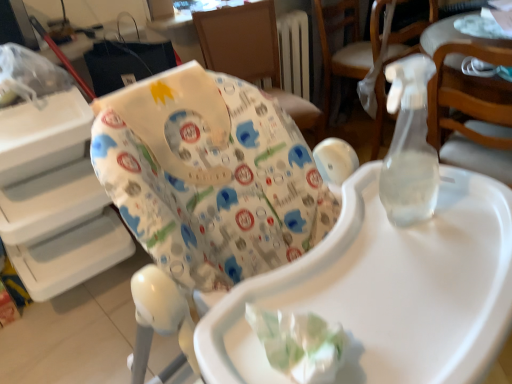
What is the approximate height of wooden chair at upper right, arranged as the 1th chair when viewed from the right?

wooden chair at upper right, arranged as the 1th chair when viewed from the right, is 31.94 inches tall.

How much space does wooden chair at upper right, arranged as the 1th chair when viewed from the right, occupy horizontally?

18.63 inches.

From the picture: In order to face white glossy table at upper right, should I rotate leftwards or rightwards?

Turn right by 29.676 degrees to look at white glossy table at upper right.

Identify the location of white fabric highchair at center, which is the first chair in left-to-right order. (252, 54).

Identify the location of wooden chair at upper right, arranged as the 1th chair when viewed from the right. (343, 47).

Considering the positions of point (455, 64) and point (329, 26), is point (455, 64) closer or farther from the camera than point (329, 26)?

Point (455, 64) is positioned closer to the camera compared to point (329, 26).

Looking at this image, is white glossy table at upper right not within wooden chair at upper right, arranged as the 1th chair when viewed from the right?

white glossy table at upper right is positioned outside wooden chair at upper right, arranged as the 1th chair when viewed from the right.

Is white glossy table at upper right wider or thinner than wooden chair at upper right, placed as the second chair when sorted from left to right?

In the image, white glossy table at upper right appears to be more narrow than wooden chair at upper right, placed as the second chair when sorted from left to right.

From the image's perspective, relative to wooden chair at upper right, arranged as the 1th chair when viewed from the right, is white glossy table at upper right above or below?

white glossy table at upper right is below wooden chair at upper right, arranged as the 1th chair when viewed from the right.

In the scene shown: Is white fabric highchair at center, which is the first chair in left-to-right order, placed right next to wooden chair at upper right, placed as the second chair when sorted from left to right?

No, white fabric highchair at center, which is the first chair in left-to-right order, is not next to wooden chair at upper right, placed as the second chair when sorted from left to right.

Is white fabric highchair at center, which is the first chair in left-to-right order, oriented away from wooden chair at upper right, arranged as the 1th chair when viewed from the right?

No.

Considering the relative sizes of white fabric highchair at center, the 2th chair from the right, and wooden chair at upper right, arranged as the 1th chair when viewed from the right, in the image provided, is white fabric highchair at center, the 2th chair from the right, wider than wooden chair at upper right, arranged as the 1th chair when viewed from the right,?

Indeed, white fabric highchair at center, the 2th chair from the right, has a greater width compared to wooden chair at upper right, arranged as the 1th chair when viewed from the right.

Who is smaller, white fabric highchair at center, which is the first chair in left-to-right order, or wooden chair at upper right, arranged as the 1th chair when viewed from the right?

With smaller size is wooden chair at upper right, arranged as the 1th chair when viewed from the right.

In the scene shown: Between white fabric baby seat at upper center and white fabric highchair at center, the 2th chair from the right, which one has more height?

white fabric baby seat at upper center is taller.

Who is smaller, white fabric baby seat at upper center or white fabric highchair at center, the 2th chair from the right?

Smaller between the two is white fabric highchair at center, the 2th chair from the right.

Would you say white fabric baby seat at upper center is a long distance from white fabric highchair at center, the 2th chair from the right?

That's right, there is a large distance between white fabric baby seat at upper center and white fabric highchair at center, the 2th chair from the right.

How much distance is there between white fabric baby seat at upper center and white fabric highchair at center, which is the first chair in left-to-right order?

white fabric baby seat at upper center is 4.28 feet from white fabric highchair at center, which is the first chair in left-to-right order.

Considering the sizes of objects white glossy table at upper right and white fabric highchair at center, which is the first chair in left-to-right order, in the image provided, who is thinner, white glossy table at upper right or white fabric highchair at center, which is the first chair in left-to-right order,?

white glossy table at upper right is thinner.

Is white glossy table at upper right oriented towards white fabric highchair at center, the 2th chair from the right?

No, white glossy table at upper right is not oriented towards white fabric highchair at center, the 2th chair from the right.

How many degrees apart are the facing directions of white glossy table at upper right and white fabric highchair at center, the 2th chair from the right?

white glossy table at upper right and white fabric highchair at center, the 2th chair from the right, are facing 94.7 degrees away from each other.

How much distance is there between white glossy table at upper right and white fabric highchair at center, the 2th chair from the right?

The distance of white glossy table at upper right from white fabric highchair at center, the 2th chair from the right, is 31.98 inches.

You are a GUI agent. You are given a task and a screenshot of the screen. Output one action in this format:
    pyautogui.click(x=<x>, y=<y>)
    Task: Click on the 1st chair counting from the left of the white glossy table at upper right
    
    Given the screenshot: What is the action you would take?
    pyautogui.click(x=343, y=47)

From the picture: Considering the relative sizes of wooden chair at upper right, placed as the second chair when sorted from left to right, and white glossy table at upper right in the image provided, is wooden chair at upper right, placed as the second chair when sorted from left to right, taller than white glossy table at upper right?

Yes.

Which is in front, point (362, 48) or point (429, 48)?

The point (429, 48) is more forward.

Can you confirm if white fabric highchair at center, the 2th chair from the right, is shorter than white fabric baby seat at upper center?

Yes, white fabric highchair at center, the 2th chair from the right, is shorter than white fabric baby seat at upper center.

Which is farther from the camera, (248, 66) or (146, 183)?

The point (248, 66) is farther.

Does white fabric highchair at center, the 2th chair from the right, appear on the right side of white fabric baby seat at upper center?

Yes.

Is wooden chair at upper right, placed as the second chair when sorted from left to right, at the back of white fabric baby seat at upper center?

No.

From a real-world perspective, between white fabric baby seat at upper center and wooden chair at upper right, placed as the second chair when sorted from left to right, who is vertically higher?

In real-world perspective, white fabric baby seat at upper center is above.

In the scene shown: Between white fabric baby seat at upper center and wooden chair at upper right, arranged as the 1th chair when viewed from the right, which one has larger size?

white fabric baby seat at upper center is bigger.

Who is shorter, white fabric baby seat at upper center or wooden chair at upper right, arranged as the 1th chair when viewed from the right?

wooden chair at upper right, arranged as the 1th chair when viewed from the right, is shorter.

This screenshot has width=512, height=384. What are the coordinates of `table below the wooden chair at upper right, arranged as the 1th chair when viewed from the right (from the image's perspective)` in the screenshot? It's located at [441, 34].

Where is `chair above the wooden chair at upper right, placed as the second chair when sorted from left to right (from a real-world perspective)`? This screenshot has width=512, height=384. chair above the wooden chair at upper right, placed as the second chair when sorted from left to right (from a real-world perspective) is located at coordinates (252, 54).

Looking at the image, which one is located closer to white glossy table at upper right, wooden chair at upper right, arranged as the 1th chair when viewed from the right, or white fabric highchair at center, which is the first chair in left-to-right order?

Based on the image, wooden chair at upper right, arranged as the 1th chair when viewed from the right, appears to be nearer to white glossy table at upper right.

Considering their positions, is white fabric highchair at center, which is the first chair in left-to-right order, positioned closer to white fabric baby seat at upper center than white glossy table at upper right?

white glossy table at upper right.

Based on their spatial positions, is white fabric baby seat at upper center or white glossy table at upper right closer to wooden chair at upper right, arranged as the 1th chair when viewed from the right?

white glossy table at upper right.

From the image, which object appears to be nearer to wooden chair at upper right, placed as the second chair when sorted from left to right, white fabric baby seat at upper center or white fabric highchair at center, which is the first chair in left-to-right order?

Among the two, white fabric highchair at center, which is the first chair in left-to-right order, is located nearer to wooden chair at upper right, placed as the second chair when sorted from left to right.

When comparing their distances from white fabric highchair at center, which is the first chair in left-to-right order, does wooden chair at upper right, placed as the second chair when sorted from left to right, or white glossy table at upper right seem further?

Based on the image, white glossy table at upper right appears to be further to white fabric highchair at center, which is the first chair in left-to-right order.

Consider the image. Estimate the real-world distances between objects in this image. Which object is further from white fabric baby seat at upper center, white fabric highchair at center, which is the first chair in left-to-right order, or wooden chair at upper right, placed as the second chair when sorted from left to right?

wooden chair at upper right, placed as the second chair when sorted from left to right, is further to white fabric baby seat at upper center.

Looking at the image, which one is located further to white glossy table at upper right, white fabric baby seat at upper center or wooden chair at upper right, placed as the second chair when sorted from left to right?

Based on the image, white fabric baby seat at upper center appears to be further to white glossy table at upper right.

From the image, which object appears to be farther from white fabric highchair at center, which is the first chair in left-to-right order, white glossy table at upper right or white fabric baby seat at upper center?

white fabric baby seat at upper center.

Image resolution: width=512 pixels, height=384 pixels. Identify the location of chair between white fabric highchair at center, the 2th chair from the right, and white glossy table at upper right, in the horizontal direction. (343, 47).

At what (x,y) coordinates should I click in order to perform the action: click on chair between white fabric baby seat at upper center and wooden chair at upper right, arranged as the 1th chair when viewed from the right, in the front-back direction. Please return your answer as a coordinate pair (x, y). The height and width of the screenshot is (384, 512). Looking at the image, I should click on (252, 54).